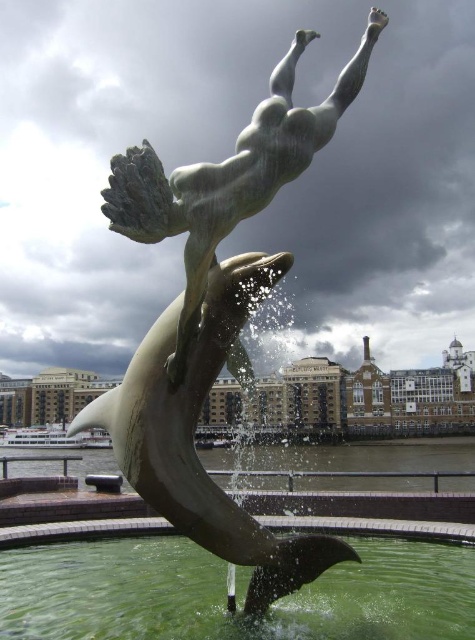
Question: Which of these objects is positioned farthest from the bronze statue at center?

Choices:
 (A) shiny silver dolphin at center
 (B) green liquid water at center

Answer: (B)

Question: Is green liquid water at center to the left of bronze statue at center from the viewer's perspective?

Choices:
 (A) yes
 (B) no

Answer: (B)

Question: Can you confirm if green liquid water at center is positioned to the left of bronze statue at center?

Choices:
 (A) no
 (B) yes

Answer: (A)

Question: Does green liquid water at center have a smaller size compared to bronze statue at center?

Choices:
 (A) yes
 (B) no

Answer: (A)

Question: Which point is closer to the camera taking this photo?

Choices:
 (A) (249, 556)
 (B) (180, 362)
 (C) (203, 554)

Answer: (A)

Question: Which object appears closest to the camera in this image?

Choices:
 (A) bronze statue at center
 (B) green liquid water at center
 (C) shiny silver dolphin at center

Answer: (C)